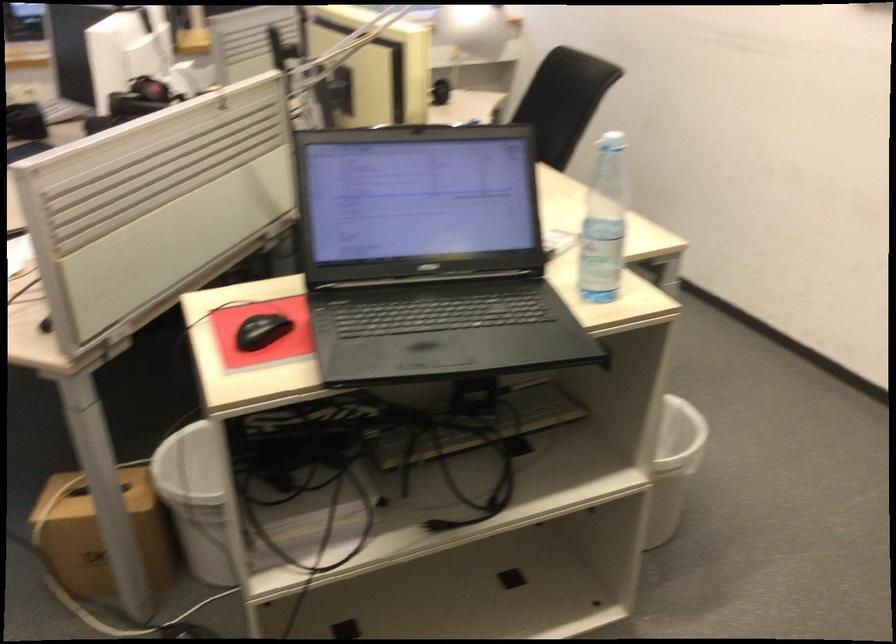
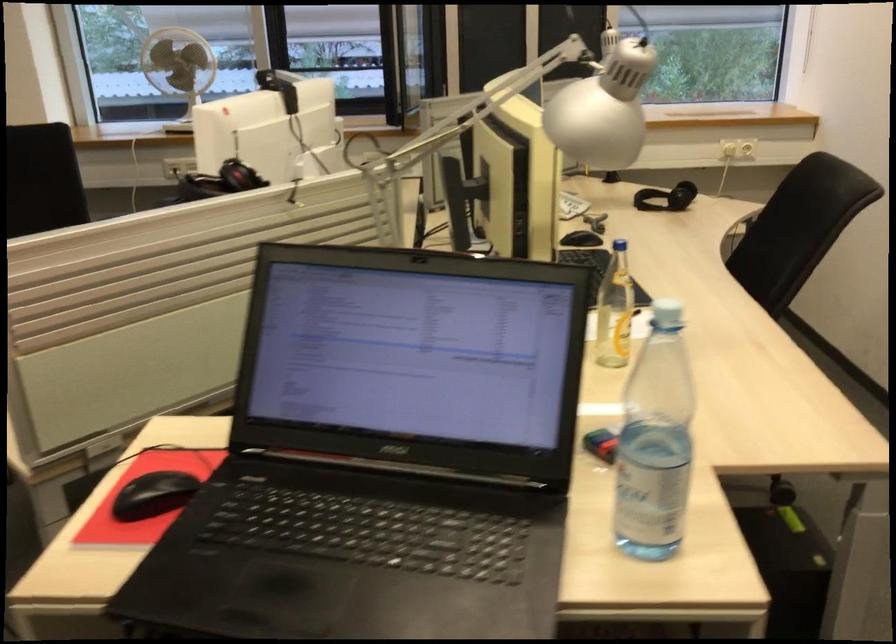
Which direction would the cameraman need to move to produce the second image?

The cameraman walked toward right, forward.